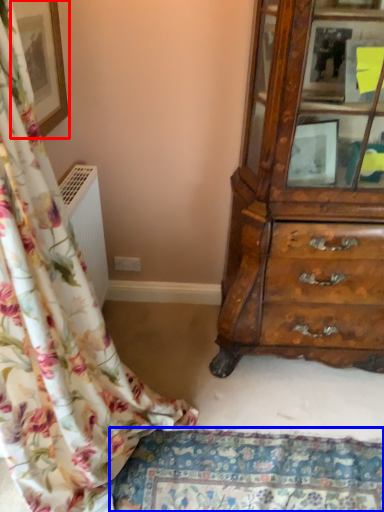
Question: Among these objects, which one is nearest to the camera, picture frame (highlighted by a red box) or mat (highlighted by a blue box)?

Choices:
 (A) picture frame
 (B) mat

Answer: (A)